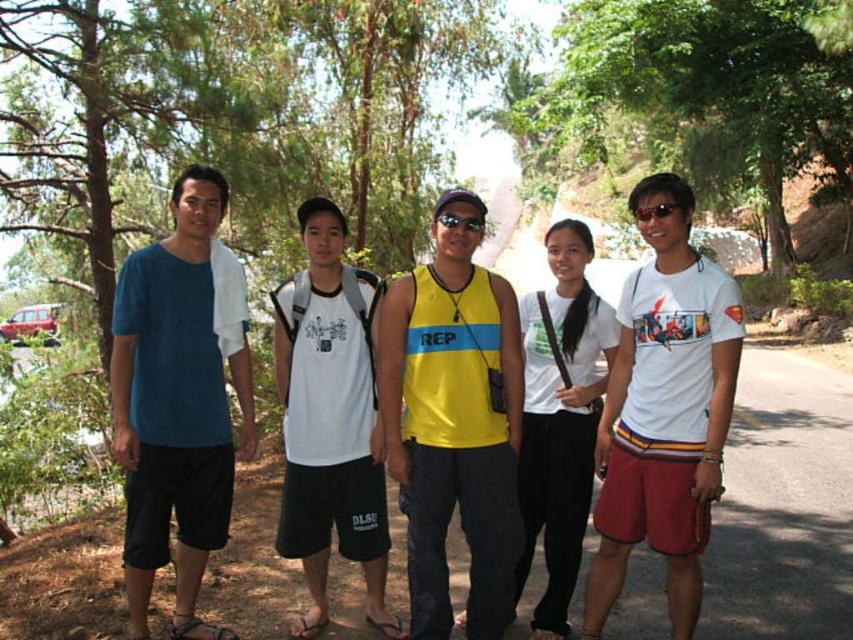
You are a photographer trying to capture a candid shot of the group. You notice the yellow matte tank top at center and the matte black sunglasses at center. Which object should you focus on first to ensure it appears larger in the photo?

The yellow matte tank top at center is closer to the viewer than the matte black sunglasses at center, so focusing on the yellow matte tank top at center will make it appear larger in the photo.

You are a photographer trying to capture a group photo of the yellow matte tank top at center and the white matte tank top at center. Since both are at the center, which one should you focus on to ensure the other is still visible in the background?

You should focus on the yellow matte tank top at center because it is in front of the white matte tank top at center, ensuring the latter remains visible in the background.